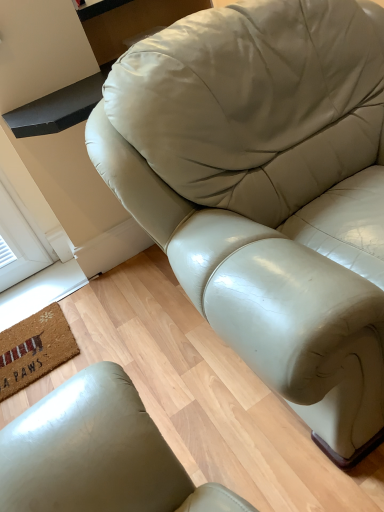
What do you see at coordinates (267, 191) in the screenshot?
I see `matte leather couch at center` at bounding box center [267, 191].

You are a GUI agent. You are given a task and a screenshot of the screen. Output one action in this format:
    pyautogui.click(x=<x>, y=<y>)
    Task: Click on the matte leather couch at center
    This screenshot has width=384, height=512.
    Given the screenshot: What is the action you would take?
    pyautogui.click(x=267, y=191)

Where is `matte leather couch at center`? The width and height of the screenshot is (384, 512). matte leather couch at center is located at coordinates (267, 191).